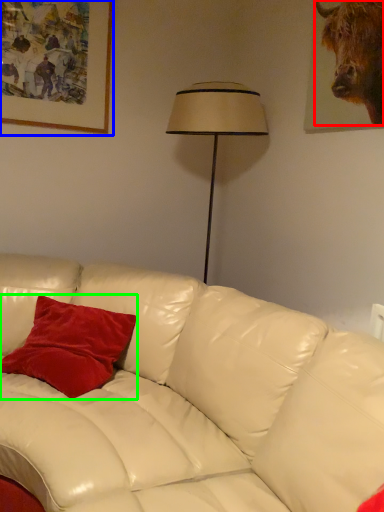
Question: Considering the real-world distances, which object is farthest from bull (highlighted by a red box)? picture frame (highlighted by a blue box) or pillow (highlighted by a green box)?

Choices:
 (A) picture frame
 (B) pillow

Answer: (B)